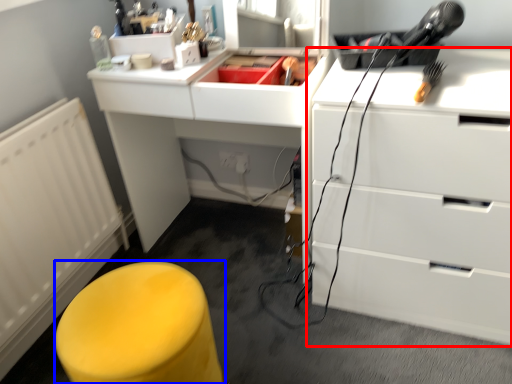
Question: Which of the following is the farthest to the observer, chest of drawers (highlighted by a red box) or furniture (highlighted by a blue box)?

Choices:
 (A) chest of drawers
 (B) furniture

Answer: (A)